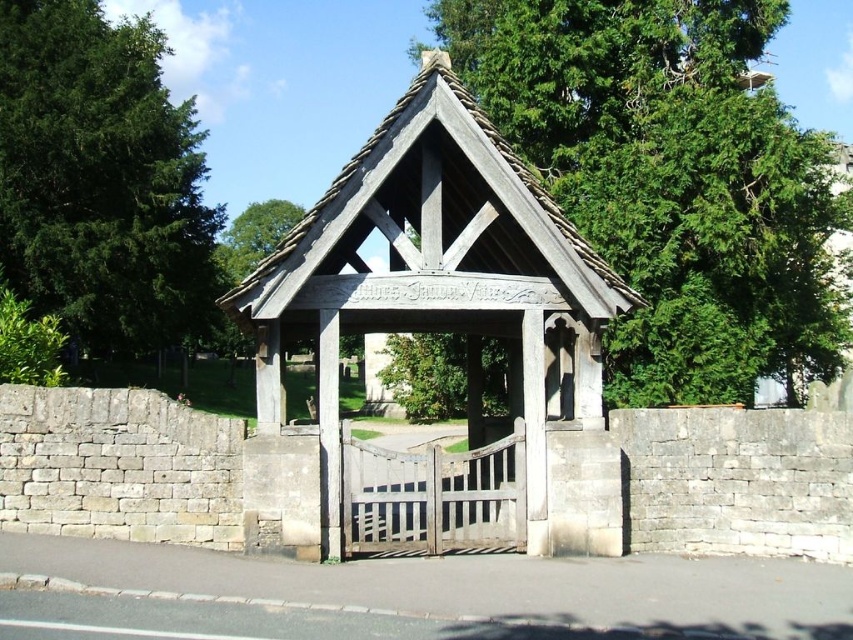
You are standing at the entrance of the churchyard and see the green leafy tree at upper center and the wooden gazebo at center. Which object is located to the right of the other?

The green leafy tree at upper center is positioned on the right side of wooden gazebo at center.

You are standing at the entrance of the churchyard looking towards the lychgate. You notice two green leafy trees in the scene. Which tree, the green leafy tree at upper center or the green leafy tree at left, is positioned lower in the image?

The green leafy tree at upper center is positioned lower than the green leafy tree at left because it is described as being below it in the image.

You are standing at the entrance of the churchyard and notice a green leafy tree at upper center and a wooden gazebo at center. Which structure appears taller from your viewpoint?

The green leafy tree at upper center is taller than the wooden gazebo at center, so it appears taller from your viewpoint.